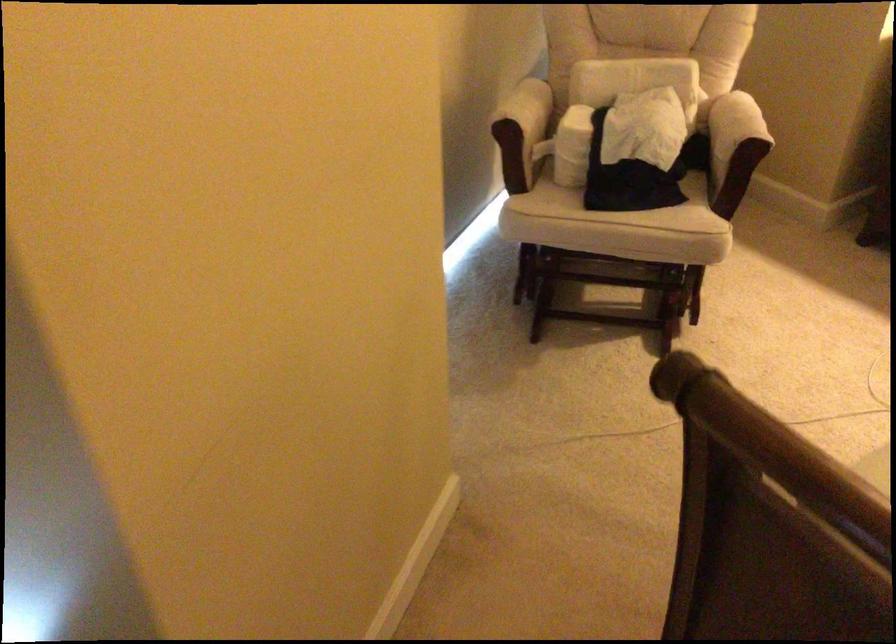
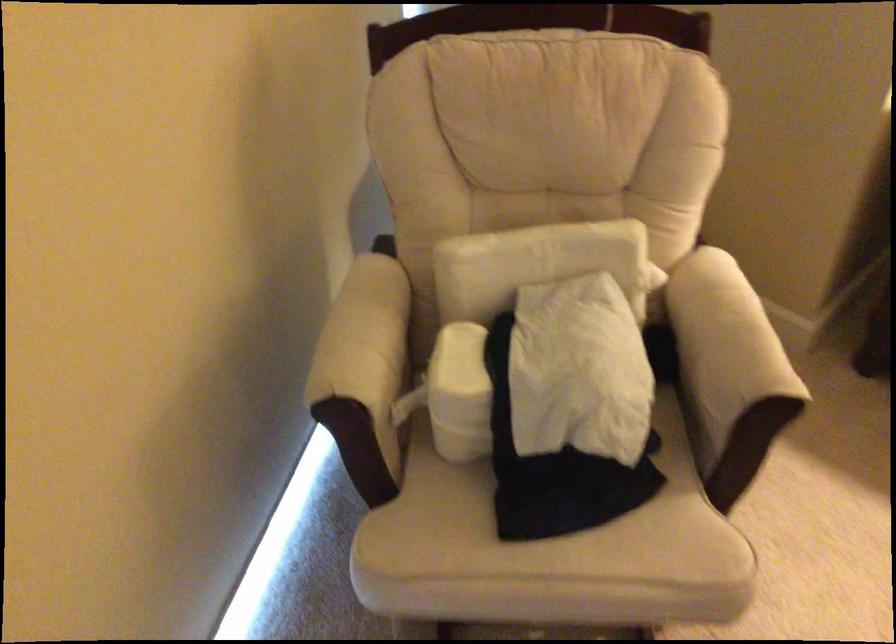
Locate, in the second image, the point that corresponds to point 575,129 in the first image.

(460, 393)